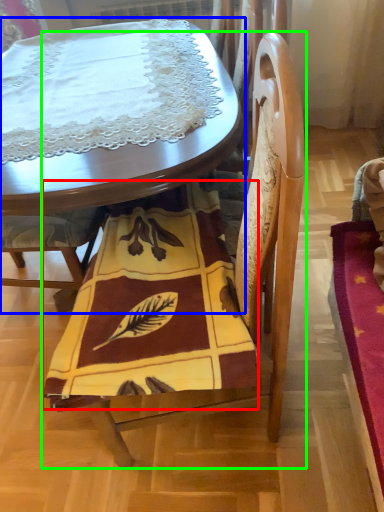
Question: Which object is the closest to the blanket (highlighted by a red box)? Choose among these: table (highlighted by a blue box) or chair (highlighted by a green box).

Choices:
 (A) table
 (B) chair

Answer: (B)